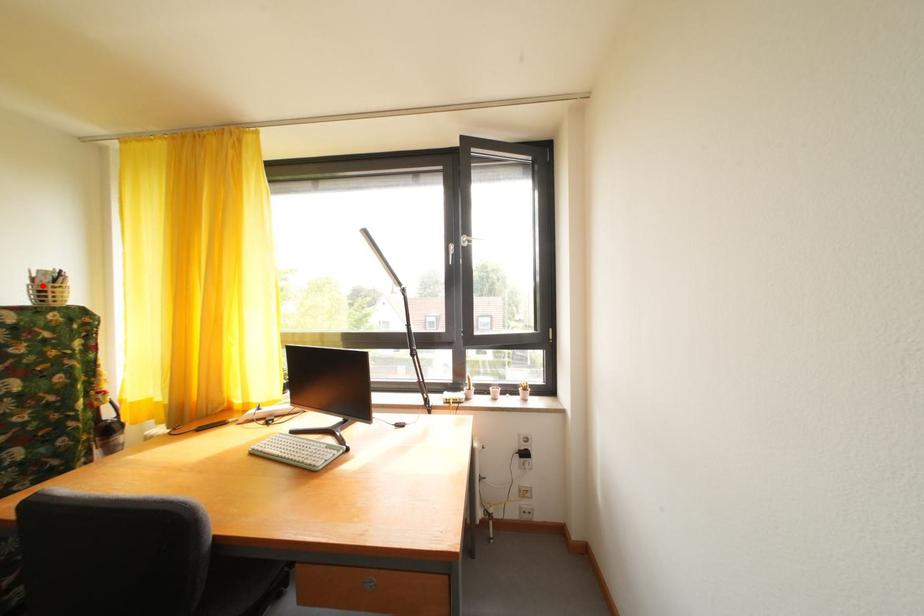
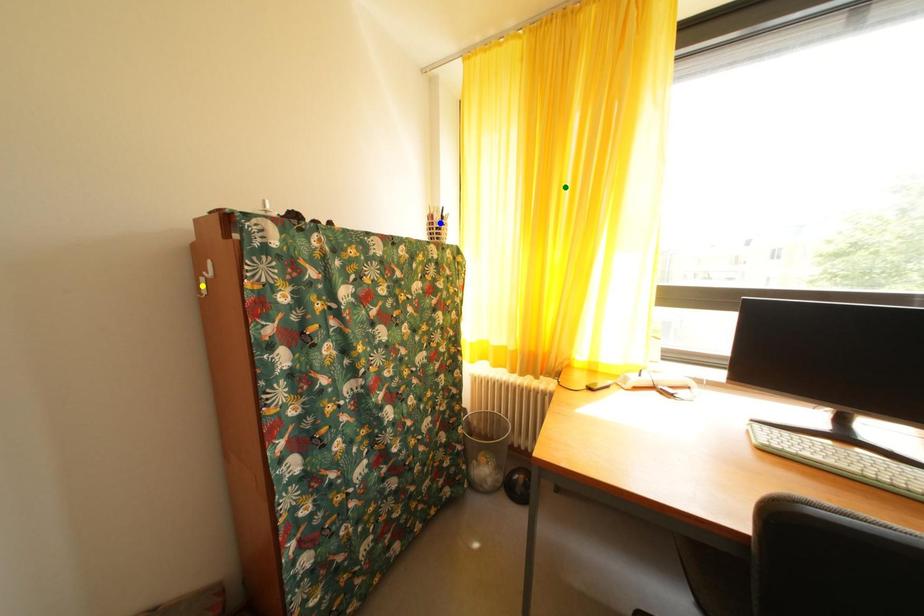
Question: I am providing you with two images of the same scene from different viewpoints. A red point is marked on the first image. You are given multiple points on the second image. In image 2, which mark is for the same physical point as the one in image 1?

Choices:
 (A) yellow point
 (B) blue point
 (C) green point

Answer: (B)